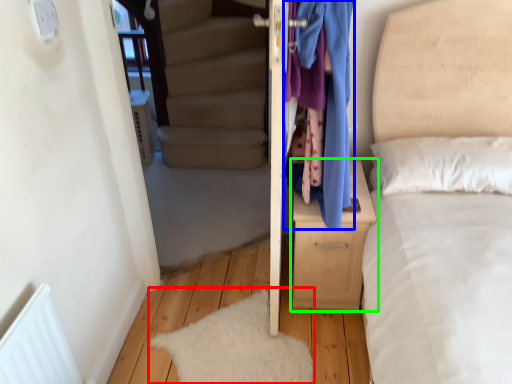
Question: Which object is the farthest from mat (highlighted by a red box)? Choose among these: clothing (highlighted by a blue box) or nightstand (highlighted by a green box).

Choices:
 (A) clothing
 (B) nightstand

Answer: (A)